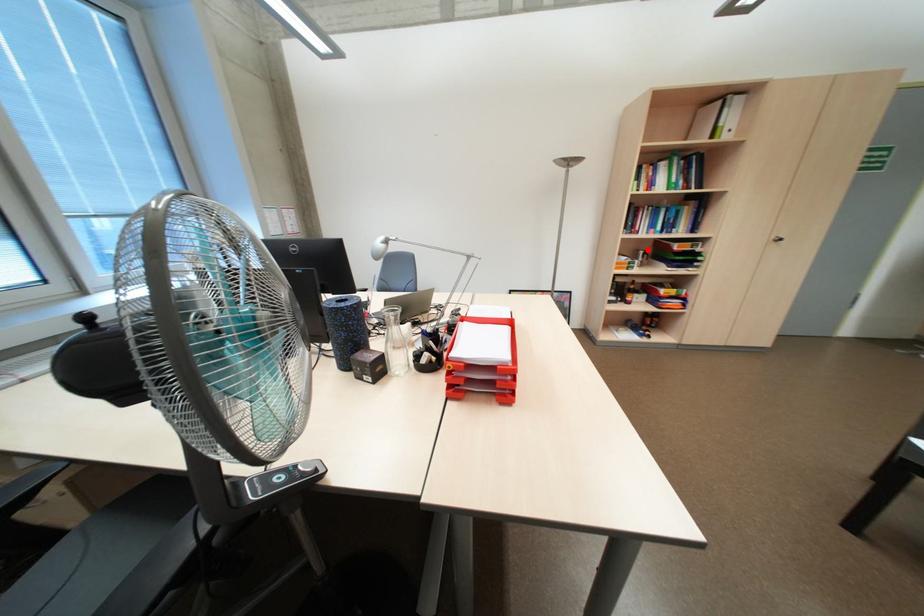
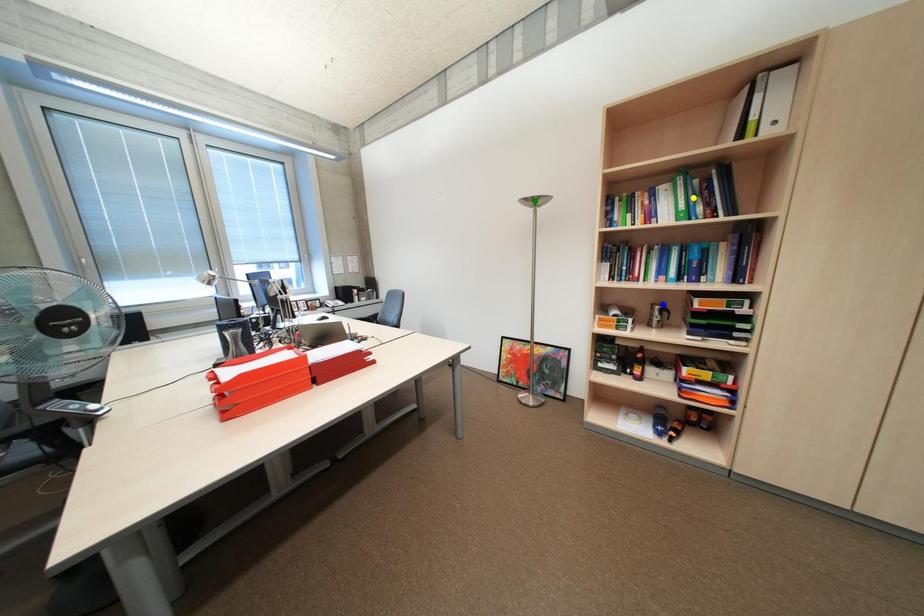
Question: I am providing you with two images of the same scene from different viewpoints. A red point is marked on the first image. You are given multiple points on the second image. Which point in image 2 represents the same 3d spot as the red point in image 1?

Choices:
 (A) blue point
 (B) green point
 (C) yellow point

Answer: (A)